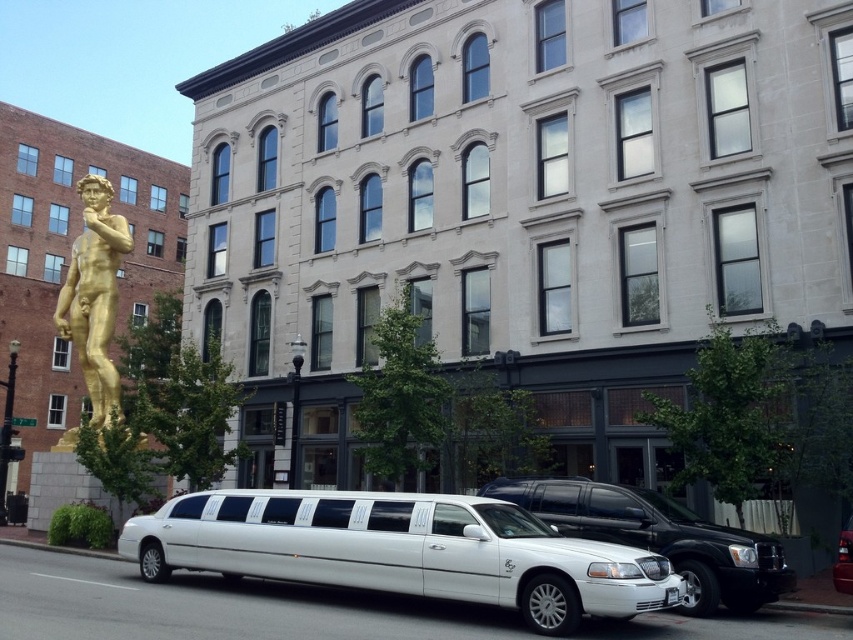
Who is more forward, (509, 582) or (107, 358)?

Point (509, 582) is in front.

Who is taller, white glossy limousine at lower center or gold polished statue at left?

gold polished statue at left

Which is behind, point (436, 563) or point (112, 396)?

The point (112, 396) is behind.

At what (x,y) coordinates should I click in order to perform the action: click on white glossy limousine at lower center. Please return your answer as a coordinate pair (x, y). Looking at the image, I should click on (403, 550).

Consider the image. Measure the distance between gold polished statue at left and white metallic limousine at center.

They are 44.84 meters apart.

The height and width of the screenshot is (640, 853). What do you see at coordinates (94, 296) in the screenshot?
I see `gold polished statue at left` at bounding box center [94, 296].

Is point (96, 218) positioned before point (842, 561)?

No, it is not.

Locate an element on the screen. gold polished statue at left is located at coordinates (94, 296).

Can you confirm if white glossy limousine at center is shorter than white metallic limousine at center?

Incorrect, white glossy limousine at center's height does not fall short of white metallic limousine at center's.

How distant is white glossy limousine at center from white metallic limousine at center?

white glossy limousine at center is 5.49 meters from white metallic limousine at center.

Who is more distant from viewer, (703, 586) or (843, 577)?

The point (703, 586) is more distant.

The height and width of the screenshot is (640, 853). Identify the location of white glossy limousine at center. (659, 538).